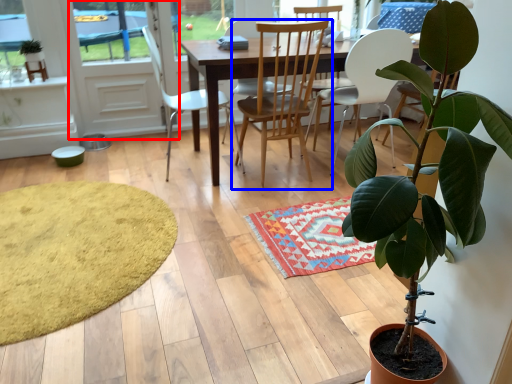
Question: Which point is further to the camera, screen door (highlighted by a red box) or chair (highlighted by a blue box)?

Choices:
 (A) screen door
 (B) chair

Answer: (A)